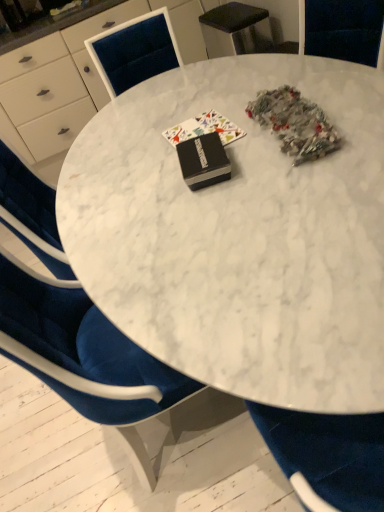
The height and width of the screenshot is (512, 384). I want to click on vacant position to the left of black matte book at center, which appears as the first book when viewed from the back, so click(139, 157).